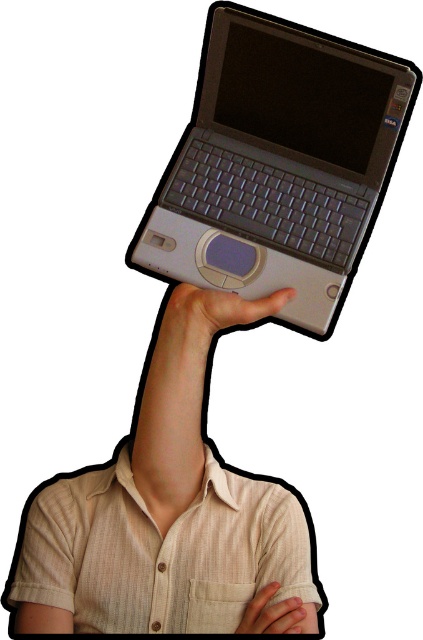
You are a delivery robot that needs to deliver a package to a specific point in the image. The package must be placed exactly at point [192,314]. Your robotic arm can reach up to 30 inches. Can you reach that point?

The distance of point [192,314] from viewer is 35.06 inches, so the robotic arm cannot reach it since it is beyond the 30 inches limit.

You are an artist trying to draw the scene described. You want to place the satin silver laptop at upper center precisely. According to the coordinates provided, where should you position it on a standard 10x10 grid?

The satin silver laptop at upper center should be placed at the coordinates corresponding to approximately 2.58 units on the x axis and 6.57 units on the y axis on a standard 10x10 grid.

You are a delivery person who needs to place both the matte gray laptop at upper center and the matte gray hand at upper center into a box. The box can only fit items that are narrower than 30 cm. Based on the scene description, can you determine if both items will fit in the box?

The matte gray laptop at upper center might be wider than matte gray hand at upper center. Since the laptop could be wider than 30 cm, it might not fit in the box. The hand is likely narrower than the laptop, so it might fit. However, without exact measurements, we cannot be certain about both items fitting.